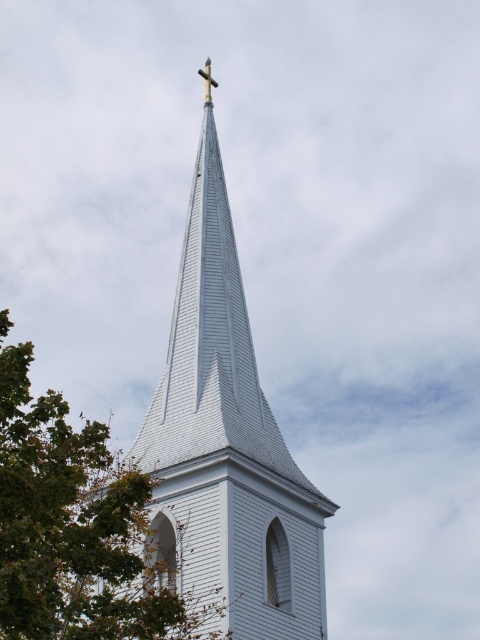
Between point (216, 566) and point (213, 83), which one is positioned in front?

Positioned in front is point (216, 566).

Does point (263, 524) come behind point (210, 65)?

No.

Which is in front, point (252, 536) or point (204, 90)?

Point (252, 536) is more forward.

Where is `white wooden steeple at center`? This screenshot has width=480, height=640. white wooden steeple at center is located at coordinates (226, 451).

Between white wooden steeple at center and green leafy tree at upper left, which one appears on the right side from the viewer's perspective?

white wooden steeple at center

Does white wooden steeple at center appear on the left side of green leafy tree at upper left?

Incorrect, white wooden steeple at center is not on the left side of green leafy tree at upper left.

I want to click on white wooden steeple at center, so click(x=226, y=451).

This screenshot has height=640, width=480. What do you see at coordinates (72, 525) in the screenshot?
I see `green leafy tree at upper left` at bounding box center [72, 525].

Which is below, green leafy tree at upper left or gold metallic cross at upper center?

green leafy tree at upper left is below.

Is point (28, 627) behind point (207, 86)?

No, (28, 627) is closer to viewer.

Identify the location of green leafy tree at upper left. Image resolution: width=480 pixels, height=640 pixels. (72, 525).